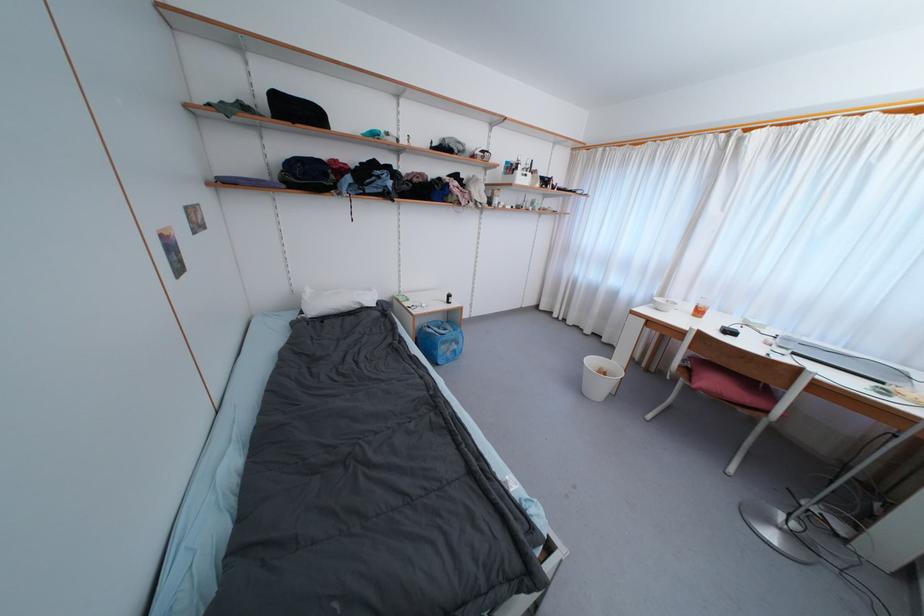
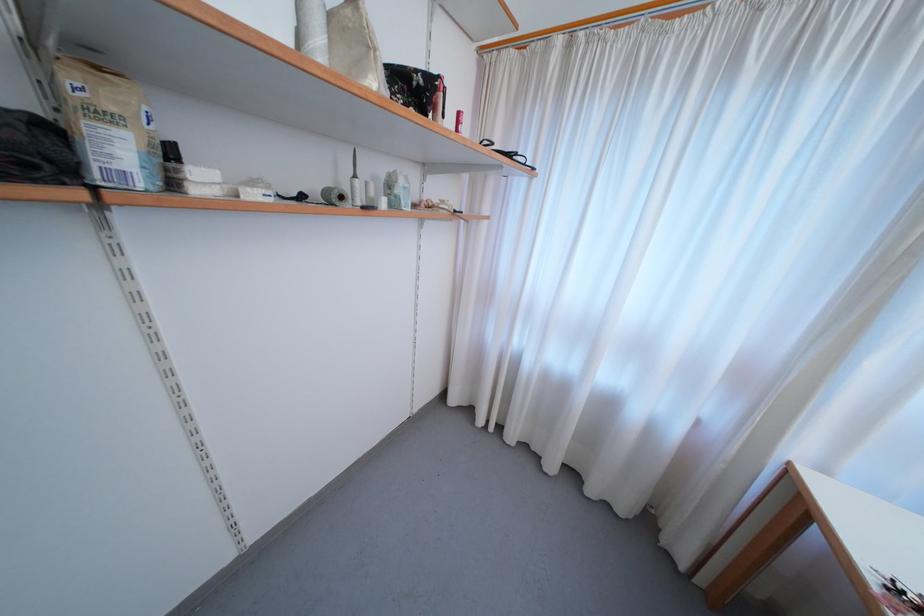
Question: In a continuous first-person perspective shot, in which direction is the camera moving?

Choices:
 (A) Left
 (B) Right
 (C) Forward
 (D) Backward

Answer: (C)